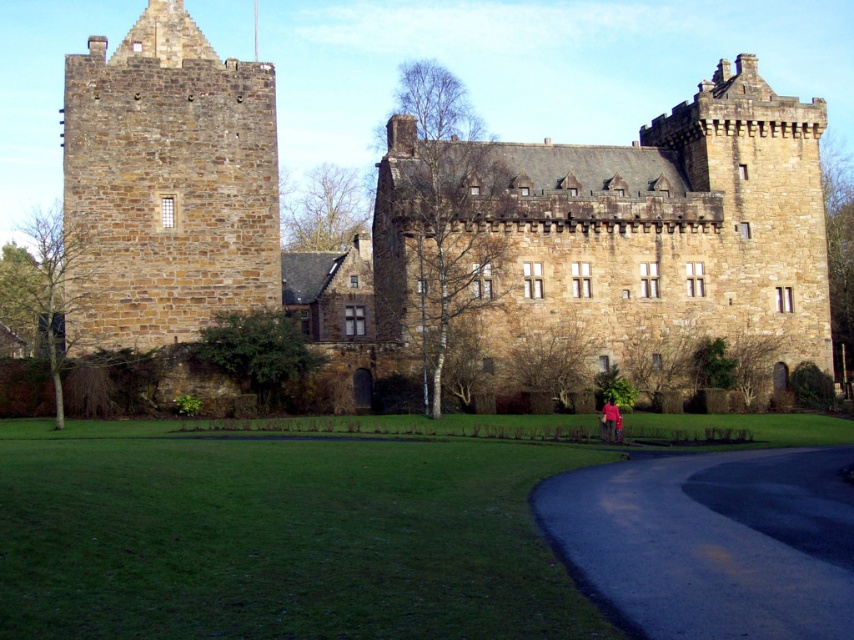
You are an architect analyzing the structure of the castle. Based on the scene, which object has a greater width between the brown stone castle at upper center and the brown stone tower at left?

The brown stone castle at upper center has a greater width than the brown stone tower at left.

You are a tour guide explaining the castle layout to visitors. You mention the brown stone castle at upper center and the dark asphalt road at lower right. Which of these two has a greater width?

The brown stone castle at upper center has a greater width than the dark asphalt road at lower right.